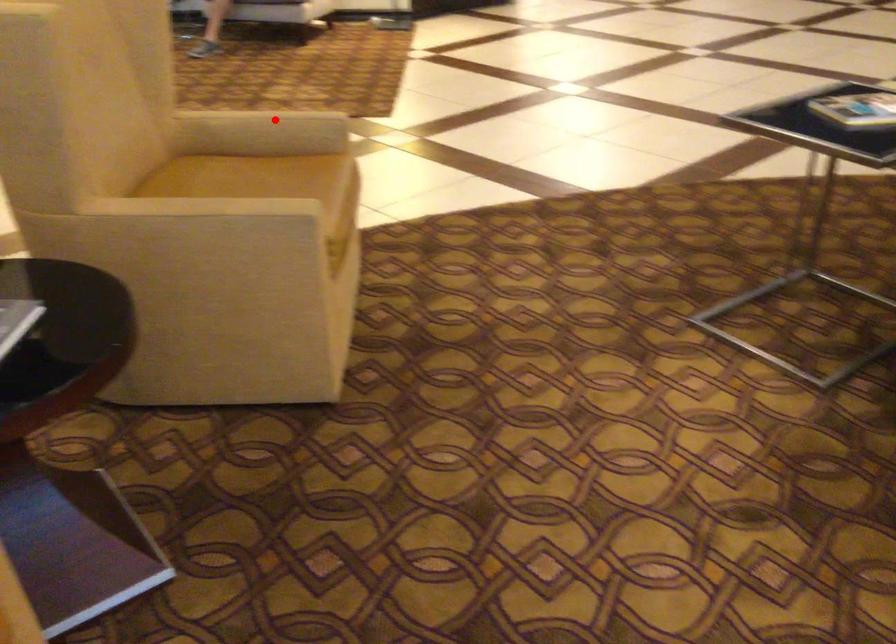
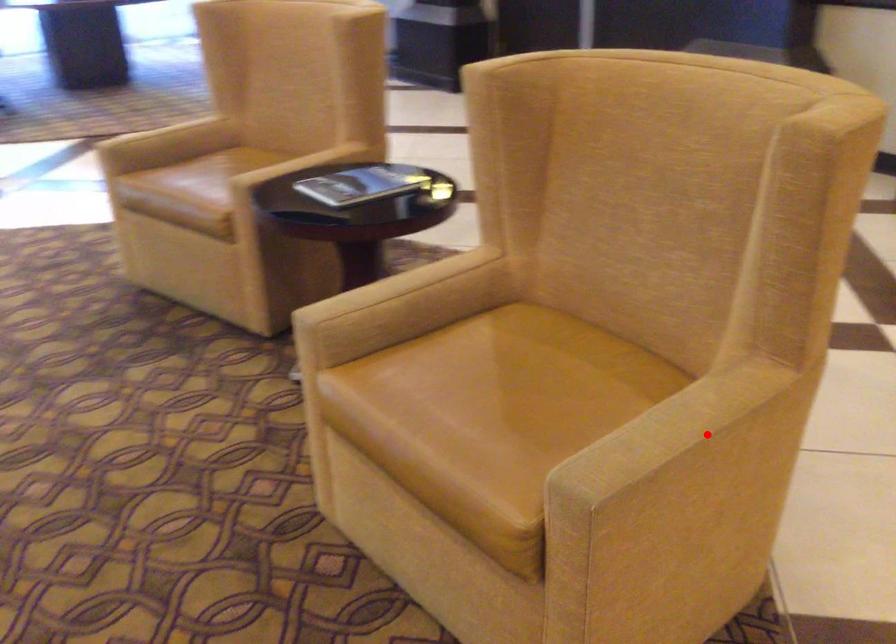
I am providing you with two images of the same scene from different viewpoints. A red point is marked on the first image and another point is marked on the second image. Are the points marked in image1 and image2 representing the same 3D position?

Yes